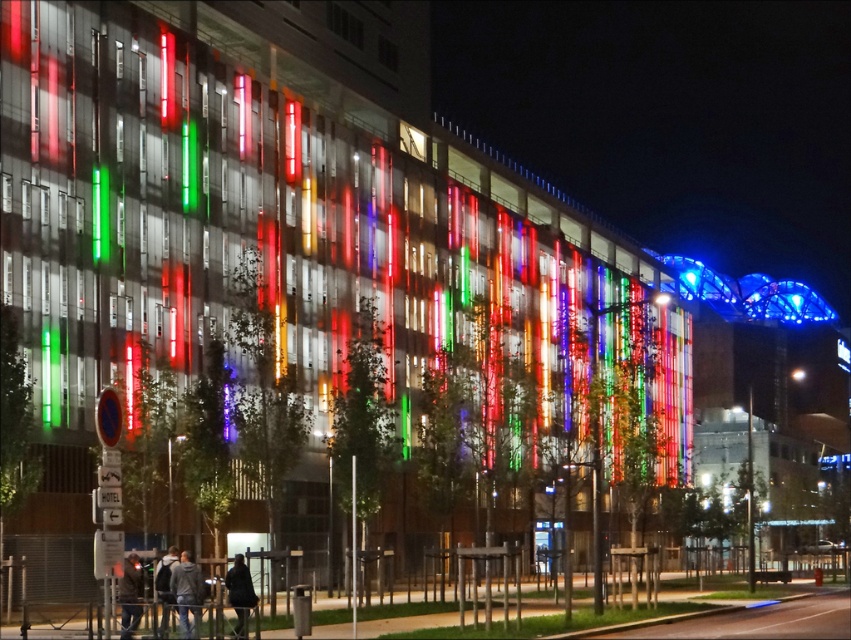
Question: Is gray fabric jacket at lower center bigger than dark gray jacket at lower left?

Choices:
 (A) no
 (B) yes

Answer: (A)

Question: Estimate the real-world distances between objects in this image. Which object is farther from the black fabric coat at lower center?

Choices:
 (A) gray fabric jacket at lower center
 (B) dark gray jacket at lower left

Answer: (B)

Question: Which point is closer to the camera?

Choices:
 (A) (127, 616)
 (B) (186, 627)
 (C) (249, 573)

Answer: (B)

Question: Does gray fabric jacket at lower center have a larger size compared to dark gray jacket at lower left?

Choices:
 (A) yes
 (B) no

Answer: (B)

Question: Which object appears closest to the camera in this image?

Choices:
 (A) dark gray jacket at lower left
 (B) black fabric coat at lower center

Answer: (A)

Question: Is the position of gray fabric jacket at lower center less distant than that of dark gray jacket at lower left?

Choices:
 (A) no
 (B) yes

Answer: (A)